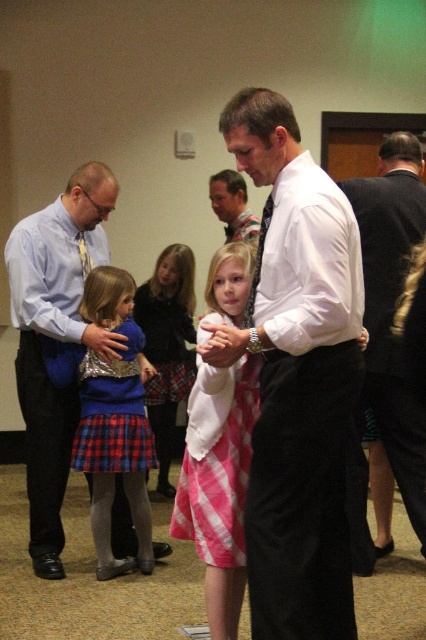
Can you confirm if brushed metal tie at left is wider than matte blue sweater at lower left?

No.

Can you confirm if brushed metal tie at left is taller than matte blue sweater at lower left?

Correct, brushed metal tie at left is much taller as matte blue sweater at lower left.

Who is more distant from viewer, [77,241] or [141,355]?

Positioned behind is point [141,355].

Locate an element on the screen. The height and width of the screenshot is (640, 426). brushed metal tie at left is located at coordinates (83, 256).

In the scene shown: Does black suit at right have a larger size compared to matte white shirt at center?

Indeed, black suit at right has a larger size compared to matte white shirt at center.

Which of these two, black suit at right or matte white shirt at center, stands shorter?

matte white shirt at center is shorter.

Is point (376, 230) closer to viewer compared to point (226, 241)?

That is True.

Locate an element on the screen. black suit at right is located at coordinates (391, 308).

Is plaid skirt at left bigger than matte white shirt at center?

Yes, plaid skirt at left is bigger than matte white shirt at center.

Between plaid skirt at left and matte white shirt at center, which one has more height?

With more height is plaid skirt at left.

Is point (104, 291) positioned before point (218, 177)?

Yes, point (104, 291) is closer to viewer.

Locate an element on the screen. plaid skirt at left is located at coordinates [x=114, y=420].